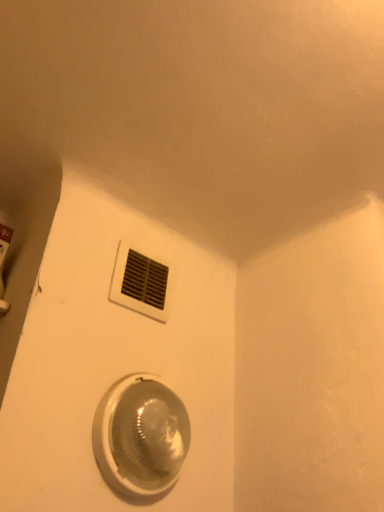
Question: From a real-world perspective, is white plastic vent at upper center located beneath translucent plastic light fixture at lower center?

Choices:
 (A) no
 (B) yes

Answer: (A)

Question: Is white plastic vent at upper center aimed at translucent plastic light fixture at lower center?

Choices:
 (A) yes
 (B) no

Answer: (B)

Question: Would you say white plastic vent at upper center contains translucent plastic light fixture at lower center?

Choices:
 (A) no
 (B) yes

Answer: (A)

Question: Is the position of white plastic vent at upper center more distant than that of translucent plastic light fixture at lower center?

Choices:
 (A) yes
 (B) no

Answer: (A)

Question: Is white plastic vent at upper center to the left of translucent plastic light fixture at lower center from the viewer's perspective?

Choices:
 (A) yes
 (B) no

Answer: (A)

Question: Considering the relative sizes of white plastic vent at upper center and translucent plastic light fixture at lower center in the image provided, is white plastic vent at upper center thinner than translucent plastic light fixture at lower center?

Choices:
 (A) no
 (B) yes

Answer: (B)

Question: Does translucent plastic light fixture at lower center have a larger size compared to white plastic vent at upper center?

Choices:
 (A) no
 (B) yes

Answer: (B)

Question: Is translucent plastic light fixture at lower center facing away from white plastic vent at upper center?

Choices:
 (A) no
 (B) yes

Answer: (A)

Question: From a real-world perspective, is translucent plastic light fixture at lower center on top of white plastic vent at upper center?

Choices:
 (A) yes
 (B) no

Answer: (B)

Question: Does translucent plastic light fixture at lower center touch white plastic vent at upper center?

Choices:
 (A) yes
 (B) no

Answer: (B)

Question: From the image's perspective, is translucent plastic light fixture at lower center above white plastic vent at upper center?

Choices:
 (A) no
 (B) yes

Answer: (A)

Question: Is translucent plastic light fixture at lower center at the left side of white plastic vent at upper center?

Choices:
 (A) no
 (B) yes

Answer: (A)

Question: Is point (120, 279) positioned closer to the camera than point (178, 443)?

Choices:
 (A) farther
 (B) closer

Answer: (A)